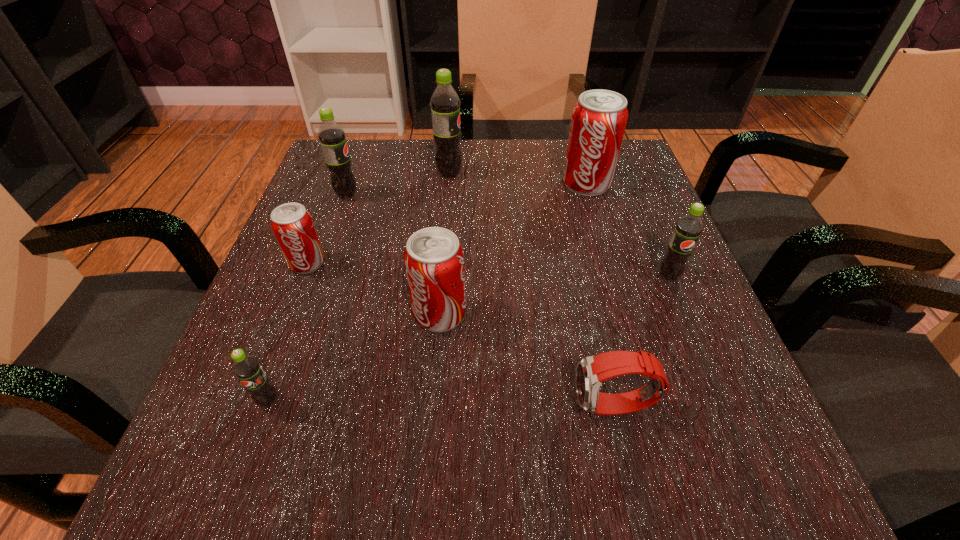
Where is `the smallest red soda can`? Image resolution: width=960 pixels, height=540 pixels. the smallest red soda can is located at coordinates (292, 224).

Identify the location of the nearest soda. (247, 368).

At what (x,y) coordinates should I click in order to perform the action: click on the nearest green soda. Please return your answer as a coordinate pair (x, y). This screenshot has width=960, height=540. Looking at the image, I should click on coord(247,368).

Where is `red watch`? The height and width of the screenshot is (540, 960). red watch is located at coordinates (591, 371).

Find the location of a particular element. The width and height of the screenshot is (960, 540). vacant space located 0.330m on the front label of the tallest object is located at coordinates (606, 174).

At what (x,y) coordinates should I click in order to perform the action: click on free region located 0.200m on the front of the rightmost red soda can. Please return your answer as a coordinate pair (x, y). The width and height of the screenshot is (960, 540). Looking at the image, I should click on (610, 262).

Locate an element on the screen. free region located 0.300m on the front label of the second biggest green soda is located at coordinates (496, 195).

This screenshot has height=540, width=960. I want to click on vacant space located 0.190m on the front label of the third biggest green soda, so click(711, 379).

Identify the location of blank space located on the left of the sixth farthest object. (287, 314).

Image resolution: width=960 pixels, height=540 pixels. What are the coordinates of `free space located on the front of the smallest red soda can` in the screenshot? It's located at (294, 296).